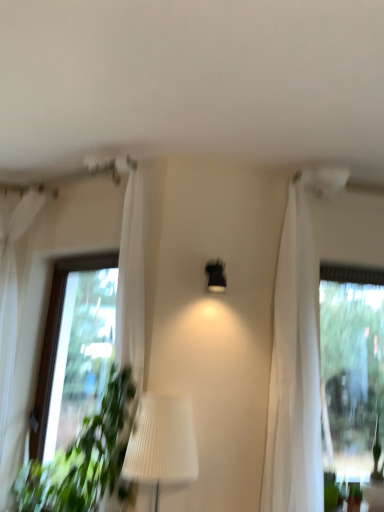
Locate an element on the screen. This screenshot has height=512, width=384. white sheer curtain at left is located at coordinates (13, 314).

The width and height of the screenshot is (384, 512). What do you see at coordinates (13, 314) in the screenshot?
I see `white sheer curtain at left` at bounding box center [13, 314].

What is the approximate width of white sheer curtain at left?

21.40 inches.

The image size is (384, 512). What are the coordinates of `matte black lamp at center` in the screenshot? It's located at (216, 276).

Describe the element at coordinates (216, 276) in the screenshot. I see `matte black lamp at center` at that location.

What is the approximate width of matte black lamp at center?

matte black lamp at center is 6.64 inches in width.

Locate an element on the screen. white sheer curtain at left is located at coordinates (13, 314).

Between white sheer curtain at left and matte black lamp at center, which one appears on the right side from the viewer's perspective?

Positioned to the right is matte black lamp at center.

Is white sheer curtain at left further to the viewer compared to matte black lamp at center?

No, white sheer curtain at left is closer to the camera.

Does point (24, 434) lie behind point (211, 278)?

Yes, point (24, 434) is behind point (211, 278).

From the image's perspective, who appears lower, white sheer curtain at left or matte black lamp at center?

white sheer curtain at left, from the image's perspective.

From a real-world perspective, is white sheer curtain at left positioned above or below matte black lamp at center?

white sheer curtain at left is situated lower than matte black lamp at center in the real world.

Between white sheer curtain at left and matte black lamp at center, which one has smaller width?

matte black lamp at center.

Considering the sizes of white sheer curtain at left and matte black lamp at center in the image, is white sheer curtain at left taller or shorter than matte black lamp at center?

Considering their sizes, white sheer curtain at left has more height than matte black lamp at center.

Between white sheer curtain at left and matte black lamp at center, which one has larger size?

white sheer curtain at left is bigger.

Consider the image. Is white sheer curtain at left completely or partially outside of matte black lamp at center?

Indeed, white sheer curtain at left is completely outside matte black lamp at center.

Is the surface of white sheer curtain at left in direct contact with matte black lamp at center?

white sheer curtain at left is not next to matte black lamp at center, and they're not touching.

Is white sheer curtain at left positioned with its back to matte black lamp at center?

white sheer curtain at left is not turned away from matte black lamp at center.

What's the angular difference between white sheer curtain at left and matte black lamp at center's facing directions?

There is a 20.8-degree angle between the facing directions of white sheer curtain at left and matte black lamp at center.

I want to click on curtain that appears below the matte black lamp at center (from the image's perspective), so click(13, 314).

Which object is positioned more to the right, matte black lamp at center or white sheer curtain at left?

matte black lamp at center is more to the right.

Relative to white sheer curtain at left, is matte black lamp at center in front or behind?

In the image, matte black lamp at center appears behind white sheer curtain at left.

Is point (210, 291) closer to camera compared to point (18, 332)?

Yes, point (210, 291) is in front of point (18, 332).

From the image's perspective, which one is positioned higher, matte black lamp at center or white sheer curtain at left?

matte black lamp at center.

Based on the photo, from a real-world perspective, does matte black lamp at center stand above white sheer curtain at left?

Yes, from a real-world perspective, matte black lamp at center is over white sheer curtain at left

Considering the sizes of objects matte black lamp at center and white sheer curtain at left in the image provided, who is wider, matte black lamp at center or white sheer curtain at left?

With larger width is white sheer curtain at left.

Considering the sizes of matte black lamp at center and white sheer curtain at left in the image, is matte black lamp at center taller or shorter than white sheer curtain at left?

Clearly, matte black lamp at center is shorter compared to white sheer curtain at left.

Considering the sizes of objects matte black lamp at center and white sheer curtain at left in the image provided, who is smaller, matte black lamp at center or white sheer curtain at left?

With smaller size is matte black lamp at center.

Is matte black lamp at center positioned beyond the bounds of white sheer curtain at left?

Yes, matte black lamp at center is located beyond the bounds of white sheer curtain at left.

Is matte black lamp at center next to white sheer curtain at left?

They are not placed beside each other.

Is matte black lamp at center aimed at white sheer curtain at left?

No, matte black lamp at center is not facing towards white sheer curtain at left.

You are a GUI agent. You are given a task and a screenshot of the screen. Output one action in this format:
    pyautogui.click(x=<x>, y=<y>)
    Task: Click on the curtain below the matte black lamp at center (from the image's perspective)
    
    Given the screenshot: What is the action you would take?
    pyautogui.click(x=13, y=314)

Locate an element on the screen. lamp that is behind the white sheer curtain at left is located at coordinates (216, 276).

Where is `lamp above the white sheer curtain at left (from the image's perspective)`? The image size is (384, 512). lamp above the white sheer curtain at left (from the image's perspective) is located at coordinates (216, 276).